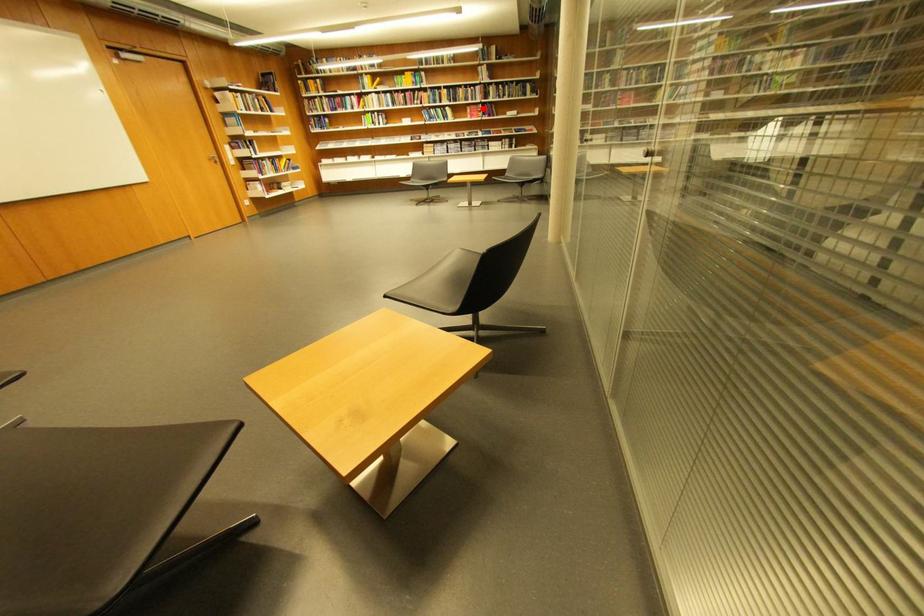
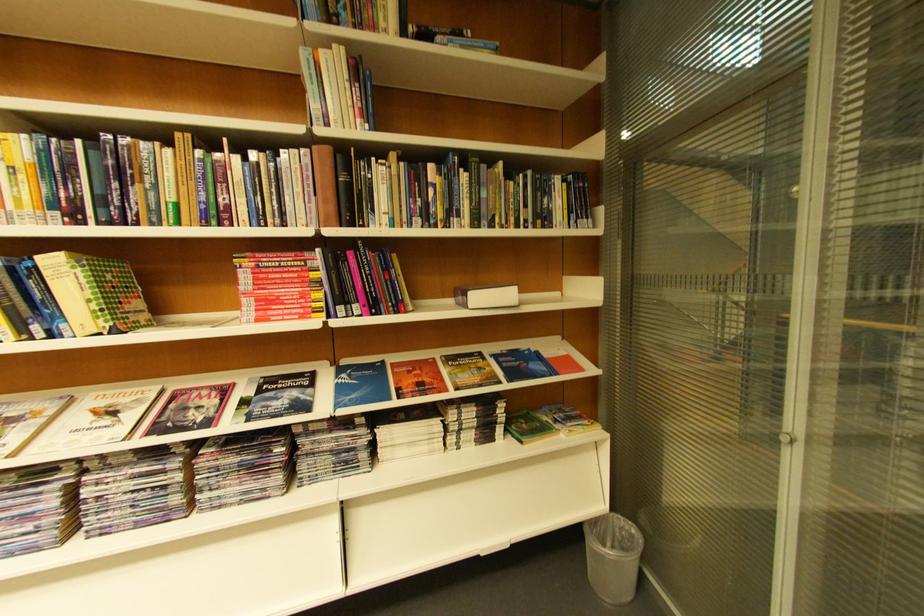
Question: I am providing you with two images of the same scene from different viewpoints. A red point is marked on the first image. Can you still see the location of the red point in image 2?

Choices:
 (A) Yes
 (B) No

Answer: (A)